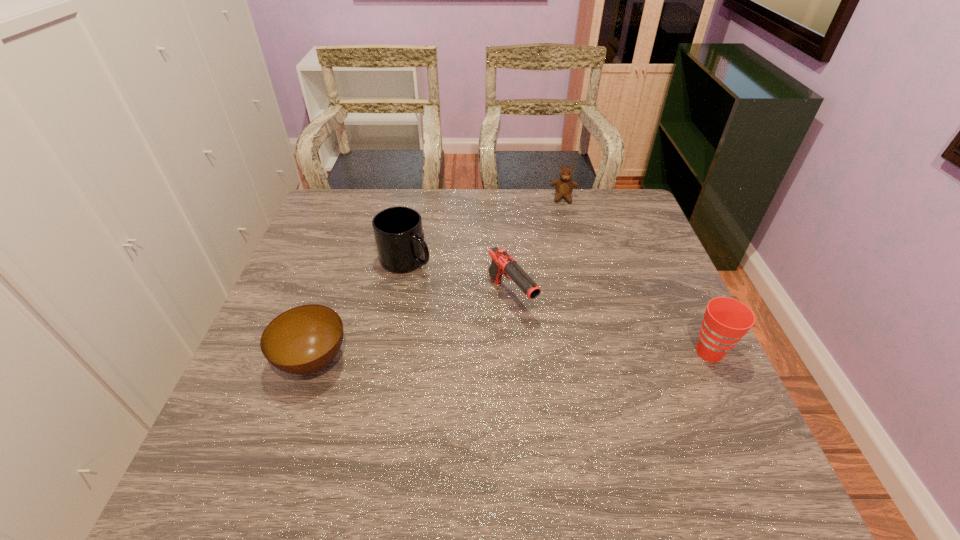
At what (x,y) coordinates should I click in order to perform the action: click on free space on the desktop that is between the shortest object and the cup and is positioned at the face of the teddy bear. Please return your answer as a coordinate pair (x, y). Looking at the image, I should click on (561, 355).

What are the coordinates of `free spot on the desktop that is between the shortest object and the rightmost object and is positioned with the handle on the side of the fourth object from right to left` in the screenshot? It's located at (499, 356).

The image size is (960, 540). In order to click on free spot on the desktop that is between the bowl and the cup and is positioned at the aiming end of the gun in this screenshot , I will do `click(562, 355)`.